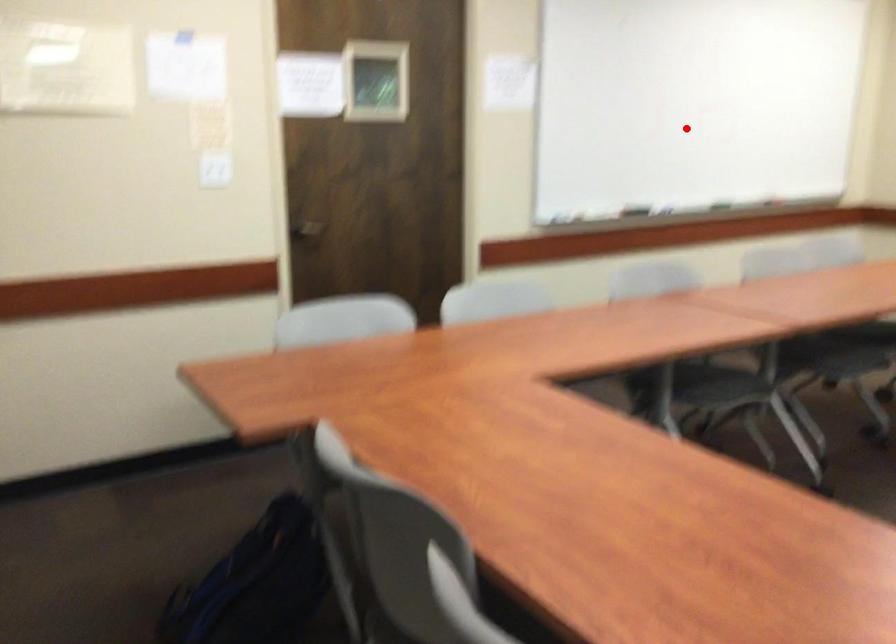
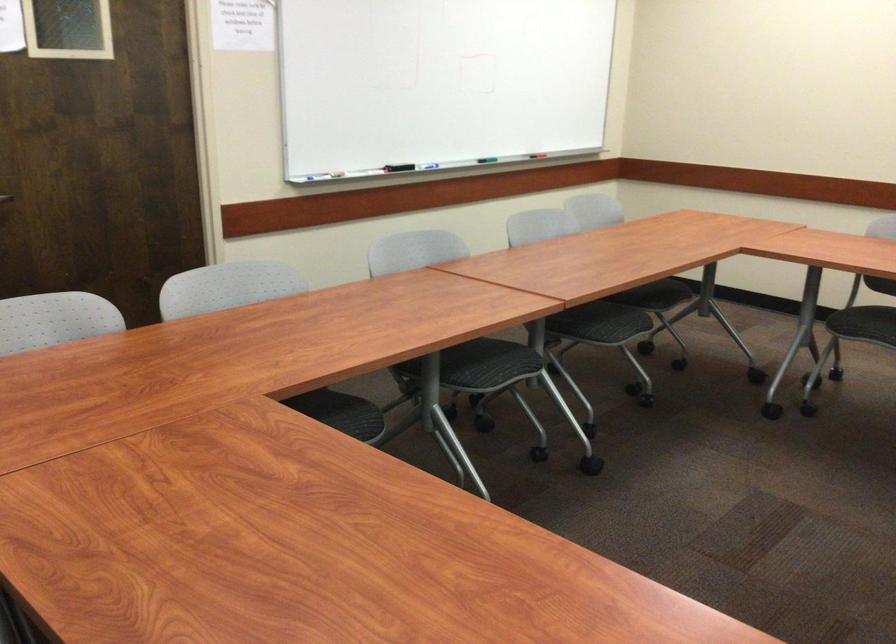
Question: I am providing you with two images of the same scene from different viewpoints. A red point is marked on the first image. At the location where the point appears in image 1, is it still visible in image 2?

Choices:
 (A) Yes
 (B) No

Answer: (A)